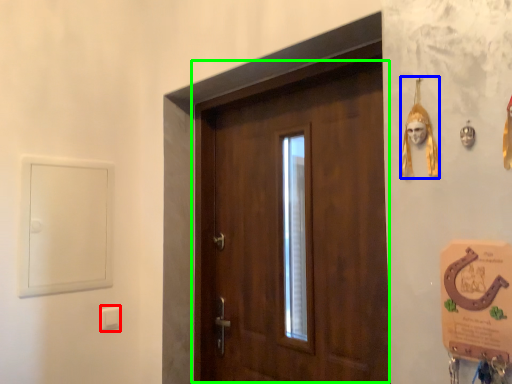
Question: Estimate the real-world distances between objects in this image. Which object is closer to light switch (highlighted by a red box), decor (highlighted by a blue box) or door (highlighted by a green box)?

Choices:
 (A) decor
 (B) door

Answer: (B)